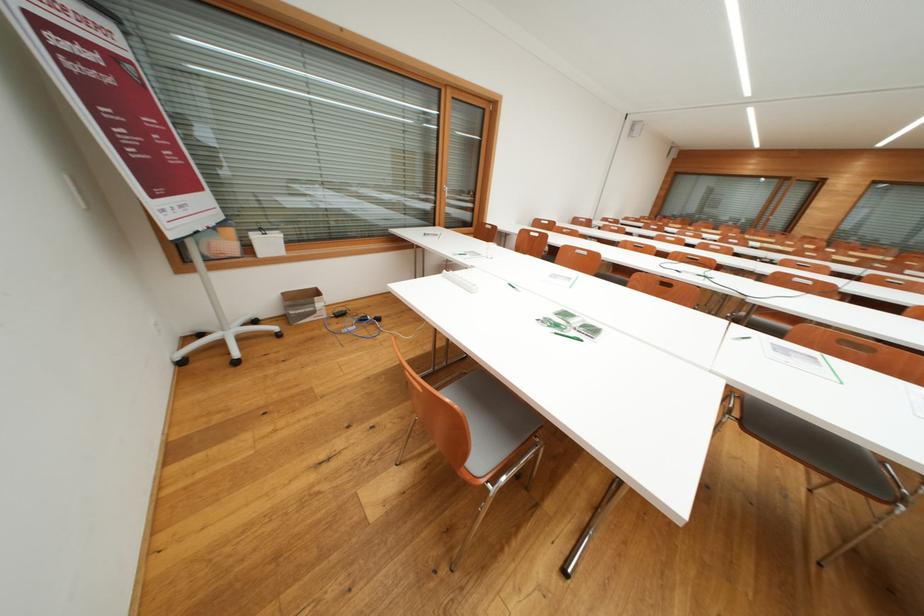
Locate an element on the screen. whiteboard stand is located at coordinates click(225, 339).